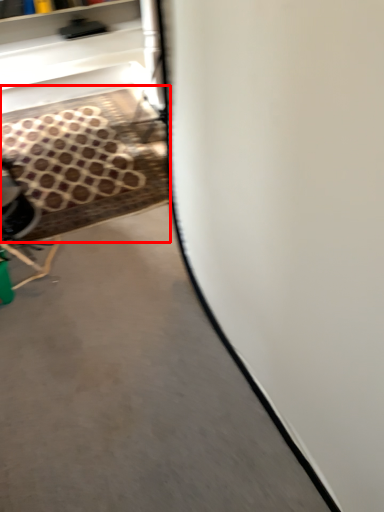
Question: From the image's perspective, where is stair (annotated by the red box) located relative to concrete?

Choices:
 (A) above
 (B) below

Answer: (A)